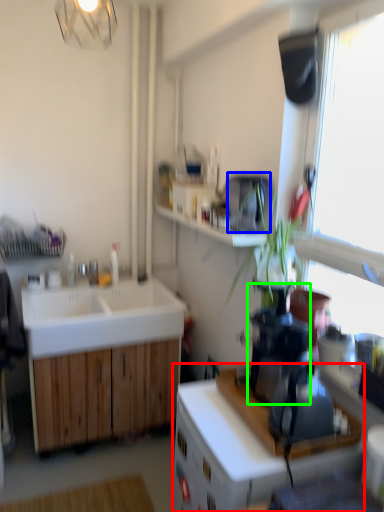
Question: Considering the real-world distances, which object is farthest from cabinetry (highlighted by a red box)? appliance (highlighted by a blue box) or coffee machine (highlighted by a green box)?

Choices:
 (A) appliance
 (B) coffee machine

Answer: (A)